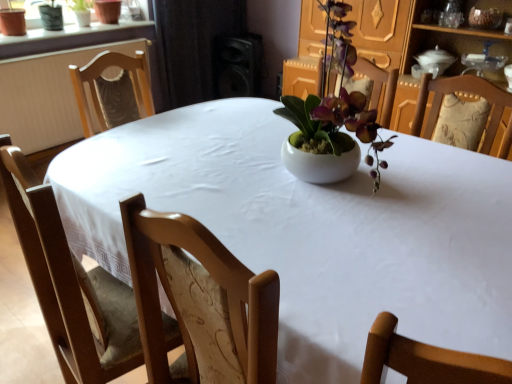
Question: Is black matte speaker at upper center positioned beyond the bounds of green matte plant at upper left?

Choices:
 (A) yes
 (B) no

Answer: (A)

Question: Does black matte speaker at upper center have a smaller size compared to green matte plant at upper left?

Choices:
 (A) no
 (B) yes

Answer: (A)

Question: Could you tell me if black matte speaker at upper center is facing green matte plant at upper left?

Choices:
 (A) no
 (B) yes

Answer: (A)

Question: Does black matte speaker at upper center touch green matte plant at upper left?

Choices:
 (A) yes
 (B) no

Answer: (B)

Question: Would you say green matte plant at upper left is part of black matte speaker at upper center's contents?

Choices:
 (A) yes
 (B) no

Answer: (B)

Question: Is black matte speaker at upper center not near green matte plant at upper left?

Choices:
 (A) no
 (B) yes

Answer: (B)

Question: Does green matte plant at upper left lie behind black matte speaker at upper center?

Choices:
 (A) yes
 (B) no

Answer: (B)

Question: From a real-world perspective, does green matte plant at upper left sit lower than black matte speaker at upper center?

Choices:
 (A) no
 (B) yes

Answer: (A)

Question: Is green matte plant at upper left facing towards black matte speaker at upper center?

Choices:
 (A) no
 (B) yes

Answer: (A)

Question: Is green matte plant at upper left surrounding black matte speaker at upper center?

Choices:
 (A) no
 (B) yes

Answer: (A)

Question: From a real-world perspective, is green matte plant at upper left over black matte speaker at upper center?

Choices:
 (A) no
 (B) yes

Answer: (B)

Question: Considering the relative sizes of green matte plant at upper left and black matte speaker at upper center in the image provided, is green matte plant at upper left wider than black matte speaker at upper center?

Choices:
 (A) yes
 (B) no

Answer: (B)

Question: Is green matte plant at upper left taller or shorter than black matte speaker at upper center?

Choices:
 (A) short
 (B) tall

Answer: (A)